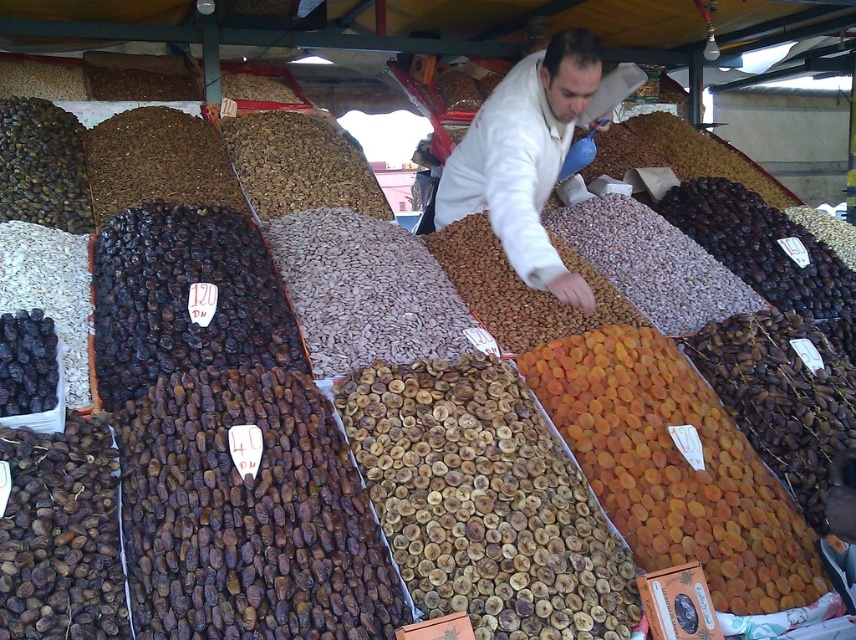
Question: Which of the following is the closest to the observer?

Choices:
 (A) (740, 588)
 (B) (533, 150)

Answer: (A)

Question: Does orange dried apricot at center lie behind white matte jacket at center?

Choices:
 (A) no
 (B) yes

Answer: (A)

Question: Which point is farther from the camera taking this photo?

Choices:
 (A) (652, 408)
 (B) (581, 296)

Answer: (B)

Question: Which point appears closest to the camera in this image?

Choices:
 (A) (684, 490)
 (B) (596, 51)

Answer: (A)

Question: Does orange dried apricot at center have a larger size compared to white matte jacket at center?

Choices:
 (A) no
 (B) yes

Answer: (A)

Question: Does orange dried apricot at center have a smaller size compared to white matte jacket at center?

Choices:
 (A) yes
 (B) no

Answer: (A)